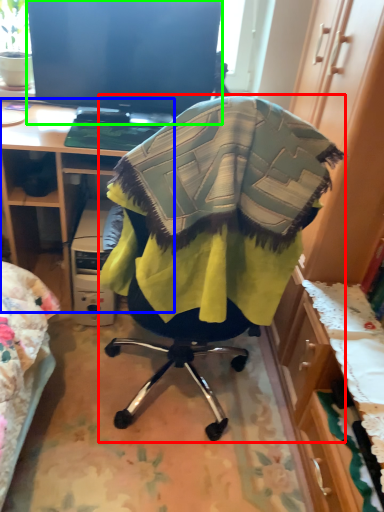
Question: Considering the real-world distances, which object is farthest from chair (highlighted by a red box)? desk (highlighted by a blue box) or television (highlighted by a green box)?

Choices:
 (A) desk
 (B) television

Answer: (B)